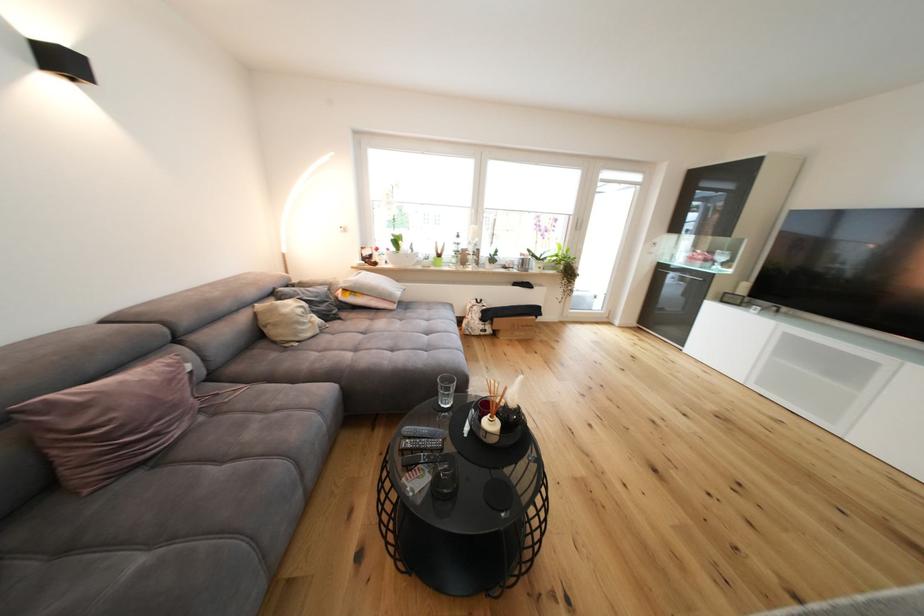
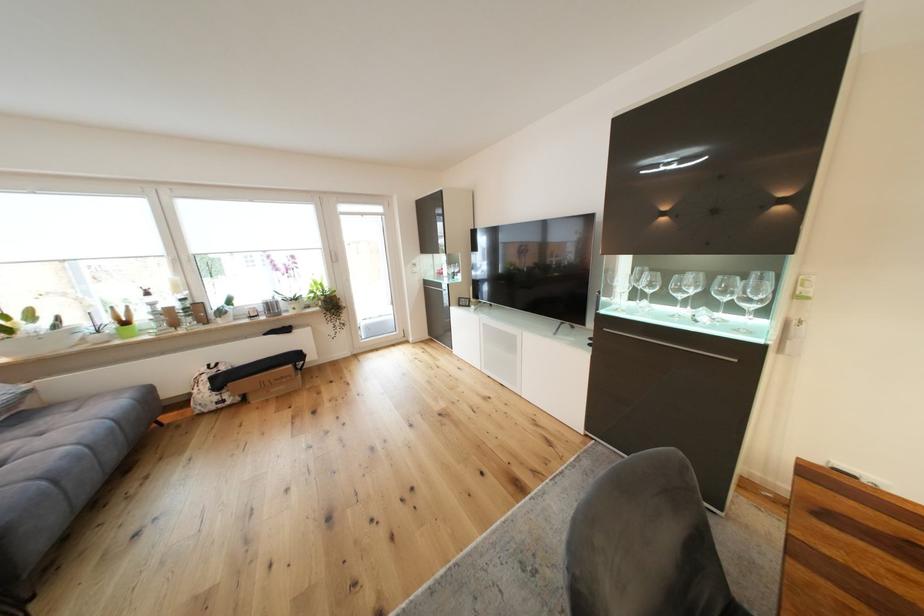
Question: In a continuous first-person perspective shot, in which direction is the camera moving?

Choices:
 (A) Left
 (B) Right
 (C) Forward
 (D) Backward

Answer: (B)